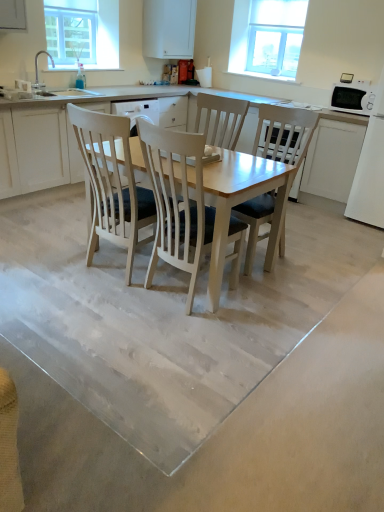
Locate an element on the screen. The width and height of the screenshot is (384, 512). vacant area that is in front of light wood chair at center, the 1th chair in the right-to-left sequence is located at coordinates (281, 295).